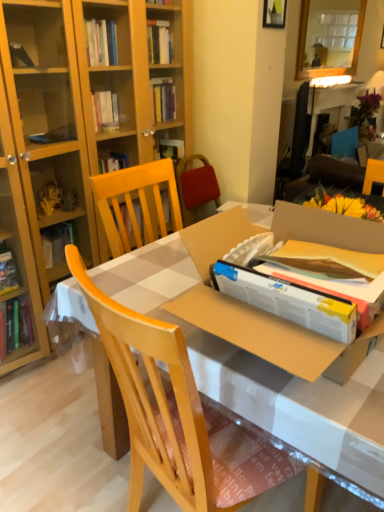
Question: Should I look upward or downward to see cardboard box at center?

Choices:
 (A) down
 (B) up

Answer: (A)

Question: Is light wood chair at center directly adjacent to glossy wooden mirror at upper center?

Choices:
 (A) no
 (B) yes

Answer: (A)

Question: Does light wood chair at center have a greater height compared to glossy wooden mirror at upper center?

Choices:
 (A) no
 (B) yes

Answer: (B)

Question: From the image's perspective, is light wood chair at center above glossy wooden mirror at upper center?

Choices:
 (A) no
 (B) yes

Answer: (A)

Question: Is light wood chair at center to the right of glossy wooden mirror at upper center from the viewer's perspective?

Choices:
 (A) no
 (B) yes

Answer: (A)

Question: From a real-world perspective, does light wood chair at center sit lower than glossy wooden mirror at upper center?

Choices:
 (A) yes
 (B) no

Answer: (A)

Question: Is light wood chair at center bigger than glossy wooden mirror at upper center?

Choices:
 (A) no
 (B) yes

Answer: (B)

Question: Does cardboard box at center have a smaller size compared to wooden picture frame at upper center?

Choices:
 (A) yes
 (B) no

Answer: (B)

Question: Can you confirm if cardboard box at center is bigger than wooden picture frame at upper center?

Choices:
 (A) yes
 (B) no

Answer: (A)

Question: Is wooden picture frame at upper center at the back of cardboard box at center?

Choices:
 (A) no
 (B) yes

Answer: (A)

Question: Could you tell me if cardboard box at center is facing wooden picture frame at upper center?

Choices:
 (A) no
 (B) yes

Answer: (A)

Question: Does cardboard box at center have a greater width compared to wooden picture frame at upper center?

Choices:
 (A) no
 (B) yes

Answer: (B)

Question: Is cardboard box at center far away from wooden picture frame at upper center?

Choices:
 (A) yes
 (B) no

Answer: (A)

Question: Is glossy wooden mirror at upper center not inside wooden picture frame at upper center?

Choices:
 (A) yes
 (B) no

Answer: (A)